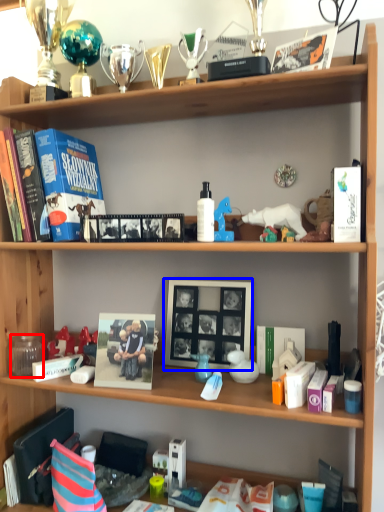
Question: Which object is further to the camera taking this photo, coffee cup (highlighted by a red box) or picture frame (highlighted by a blue box)?

Choices:
 (A) coffee cup
 (B) picture frame

Answer: (A)